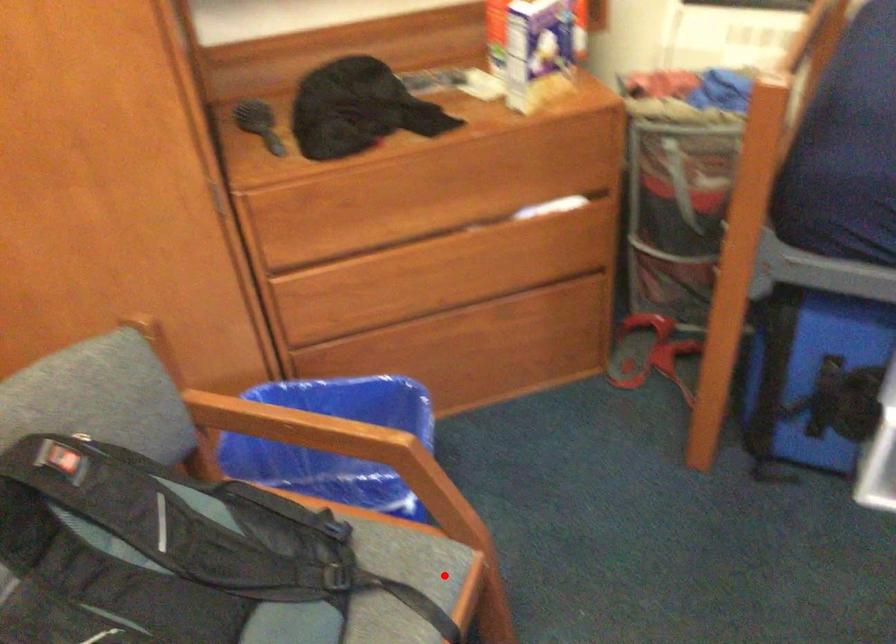
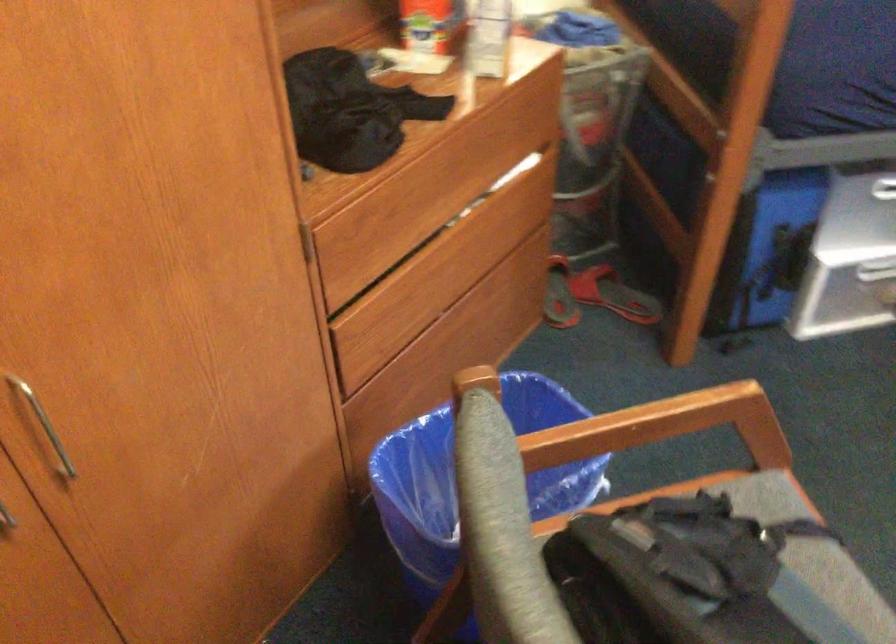
Locate, in the second image, the point that corresponds to the highlighted location in the first image.

(769, 504)